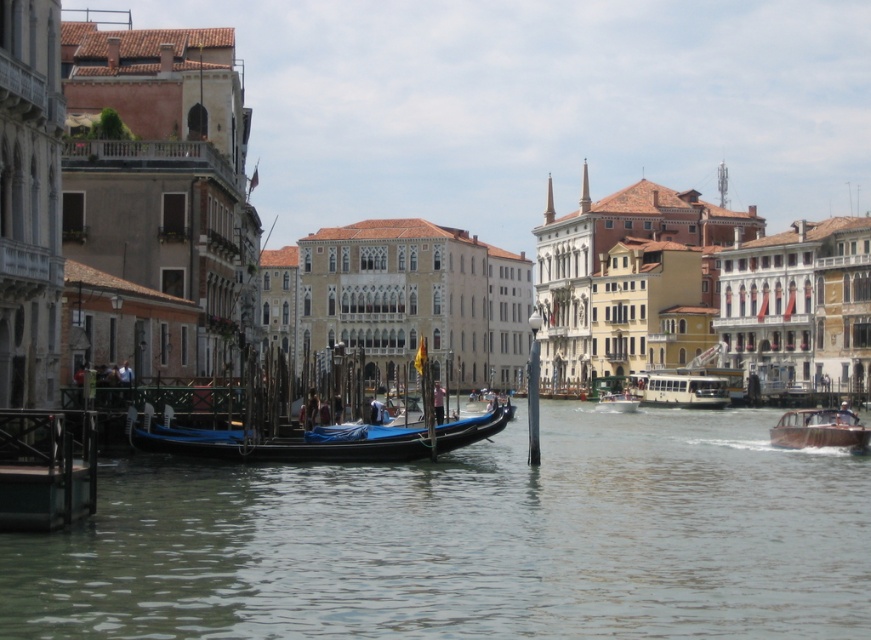
Between point (653, 381) and point (636, 404), which one is positioned behind?

The point (653, 381) is more distant.

Can you confirm if white glossy bus at center is thinner than white plastic boat at center?

No.

Describe the element at coordinates (680, 388) in the screenshot. I see `white glossy bus at center` at that location.

You are a GUI agent. You are given a task and a screenshot of the screen. Output one action in this format:
    pyautogui.click(x=<x>, y=<y>)
    Task: Click on the white glossy bus at center
    The width and height of the screenshot is (871, 640).
    Given the screenshot: What is the action you would take?
    pyautogui.click(x=680, y=388)

This screenshot has width=871, height=640. Describe the element at coordinates (820, 429) in the screenshot. I see `wooden polished boat at right` at that location.

Does wooden polished boat at right have a greater width compared to white glossy bus at center?

Correct, the width of wooden polished boat at right exceeds that of white glossy bus at center.

Is point (781, 424) closer to viewer compared to point (679, 404)?

Yes, it is in front of point (679, 404).

Identify the location of wooden polished boat at right. This screenshot has height=640, width=871. (820, 429).

Is point (849, 436) behind point (599, 401)?

That is False.

Can you confirm if wooden polished boat at right is bigger than white plastic boat at center?

Yes, wooden polished boat at right is bigger than white plastic boat at center.

I want to click on wooden polished boat at right, so click(x=820, y=429).